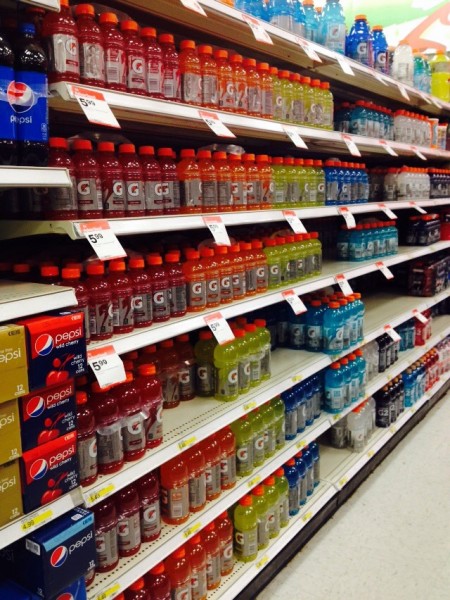
I want to click on shelves, so 308,513, 276,465, 231,413, 189,321, 170,221, 160,105, 281,31.